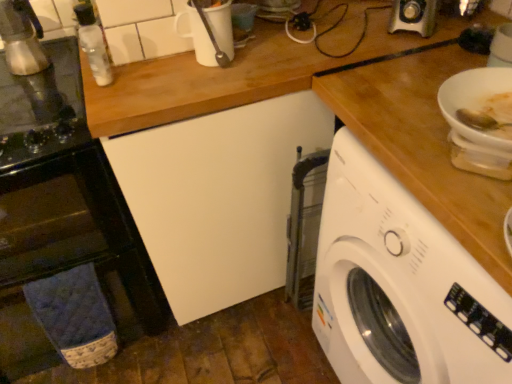
Question: From the image's perspective, is white plastic washing machine at right on metallic silver coffee maker at left, placed as the second appliance when sorted from top to bottom?

Choices:
 (A) yes
 (B) no

Answer: (B)

Question: Does white plastic washing machine at right turn towards metallic silver coffee maker at left, which is the 1th appliance from bottom to top?

Choices:
 (A) yes
 (B) no

Answer: (B)

Question: From a real-world perspective, is white plastic washing machine at right under metallic silver coffee maker at left, placed as the second appliance when sorted from top to bottom?

Choices:
 (A) yes
 (B) no

Answer: (A)

Question: Is white plastic washing machine at right to the left of metallic silver coffee maker at left, placed as the second appliance when sorted from top to bottom, from the viewer's perspective?

Choices:
 (A) no
 (B) yes

Answer: (A)

Question: Can you confirm if white plastic washing machine at right is bigger than metallic silver coffee maker at left, which is the 1th appliance from bottom to top?

Choices:
 (A) yes
 (B) no

Answer: (A)

Question: From the image's perspective, relative to white matte bowl at upper right, is clear glass bottle at upper left above or below?

Choices:
 (A) below
 (B) above

Answer: (B)

Question: Looking at the image, does clear glass bottle at upper left seem bigger or smaller compared to white matte bowl at upper right?

Choices:
 (A) big
 (B) small

Answer: (B)

Question: In the image, is clear glass bottle at upper left positioned in front of or behind white matte bowl at upper right?

Choices:
 (A) front
 (B) behind

Answer: (B)

Question: Is clear glass bottle at upper left inside or outside of white matte bowl at upper right?

Choices:
 (A) inside
 (B) outside

Answer: (B)

Question: From the image's perspective, is clear glass bottle at upper left positioned above or below blue fabric oven towel at lower left?

Choices:
 (A) below
 (B) above

Answer: (B)

Question: Is clear glass bottle at upper left wider or thinner than blue fabric oven towel at lower left?

Choices:
 (A) thin
 (B) wide

Answer: (A)

Question: Considering the positions of clear glass bottle at upper left and blue fabric oven towel at lower left in the image, is clear glass bottle at upper left taller or shorter than blue fabric oven towel at lower left?

Choices:
 (A) short
 (B) tall

Answer: (A)

Question: In the image, is clear glass bottle at upper left positioned in front of or behind blue fabric oven towel at lower left?

Choices:
 (A) behind
 (B) front

Answer: (A)

Question: In terms of width, does metallic silver espresso maker at left, arranged as the 2th appliance when ordered from the bottom, look wider or thinner when compared to metallic silver coffee maker at left, placed as the second appliance when sorted from top to bottom?

Choices:
 (A) wide
 (B) thin

Answer: (B)

Question: In terms of height, does metallic silver espresso maker at left, the first appliance in the top-to-bottom sequence, look taller or shorter compared to metallic silver coffee maker at left, which is the 1th appliance from bottom to top?

Choices:
 (A) short
 (B) tall

Answer: (B)